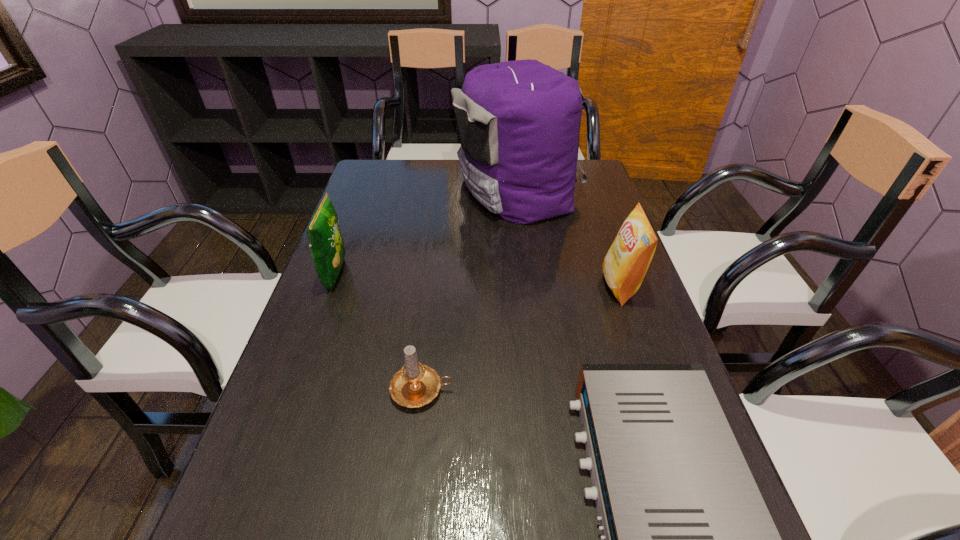
Where is `backpack`? backpack is located at coordinates click(518, 122).

Identify the location of the tallest object. Image resolution: width=960 pixels, height=540 pixels. (518, 122).

Identify the location of the left crisp (potato chip). Image resolution: width=960 pixels, height=540 pixels. (326, 244).

The height and width of the screenshot is (540, 960). Identify the location of the right crisp (potato chip). (626, 262).

At what (x,y) coordinates should I click in order to perform the action: click on the fourth tallest object. Please return your answer as a coordinate pair (x, y). Looking at the image, I should click on (415, 384).

Identify the location of vacant space positioned 0.190m on the front pocket of the tallest object. (396, 190).

Find the location of a particular element. The height and width of the screenshot is (540, 960). vacant space located 0.280m on the front pocket of the tallest object is located at coordinates (368, 190).

The image size is (960, 540). Identify the location of blank area located 0.190m on the front pocket of the tallest object. (396, 190).

Find the location of `free space located on the front-facing side of the leftmost object`. free space located on the front-facing side of the leftmost object is located at coordinates (479, 275).

At what (x,y) coordinates should I click in order to perform the action: click on vacant space located on the front-facing side of the right crisp (potato chip). Please return your answer as a coordinate pair (x, y). Image resolution: width=960 pixels, height=540 pixels. Looking at the image, I should click on (571, 286).